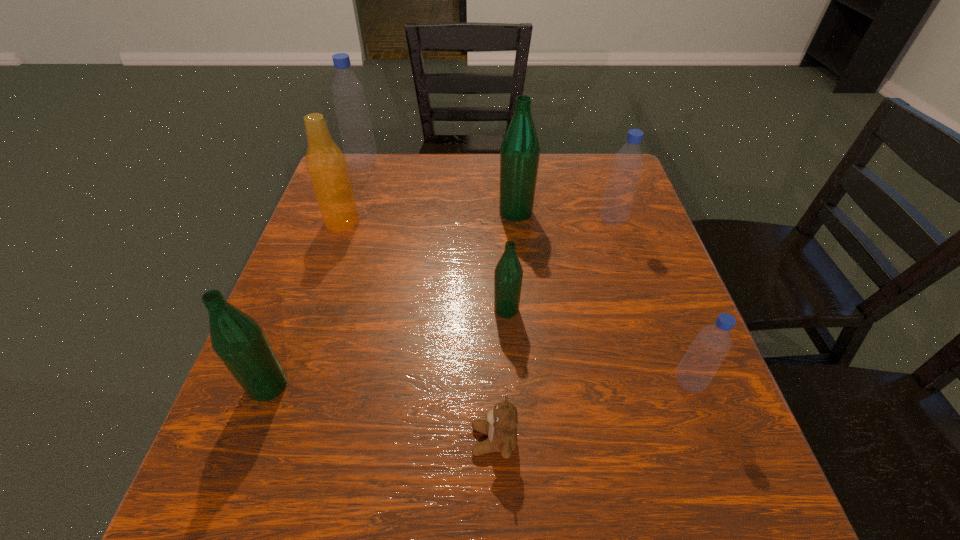
Where is `blank space located 0.190m on the front-facing side of the shortest object`? This screenshot has height=540, width=960. blank space located 0.190m on the front-facing side of the shortest object is located at coordinates [355, 440].

This screenshot has width=960, height=540. I want to click on blank space located 0.390m on the front-facing side of the shortest object, so click(231, 440).

Locate an element on the screen. The height and width of the screenshot is (540, 960). object that is at the far edge is located at coordinates (358, 142).

Locate an element on the screen. object situated at the near edge is located at coordinates click(x=501, y=425).

This screenshot has height=540, width=960. What are the coordinates of `beer bottle that is positioned at the left edge` in the screenshot? It's located at (326, 165).

This screenshot has width=960, height=540. Find the location of `object situated at the far left corner`. object situated at the far left corner is located at coordinates (358, 142).

Identify the location of vacant position at the far edge of the desktop. (393, 197).

This screenshot has width=960, height=540. What are the coordinates of `free space at the left edge` in the screenshot? It's located at (324, 347).

The image size is (960, 540). In the image, there is a desktop. In order to click on free space at the right edge in this screenshot , I will do `click(651, 403)`.

The image size is (960, 540). I want to click on vacant space at the near left corner of the desktop, so click(x=186, y=518).